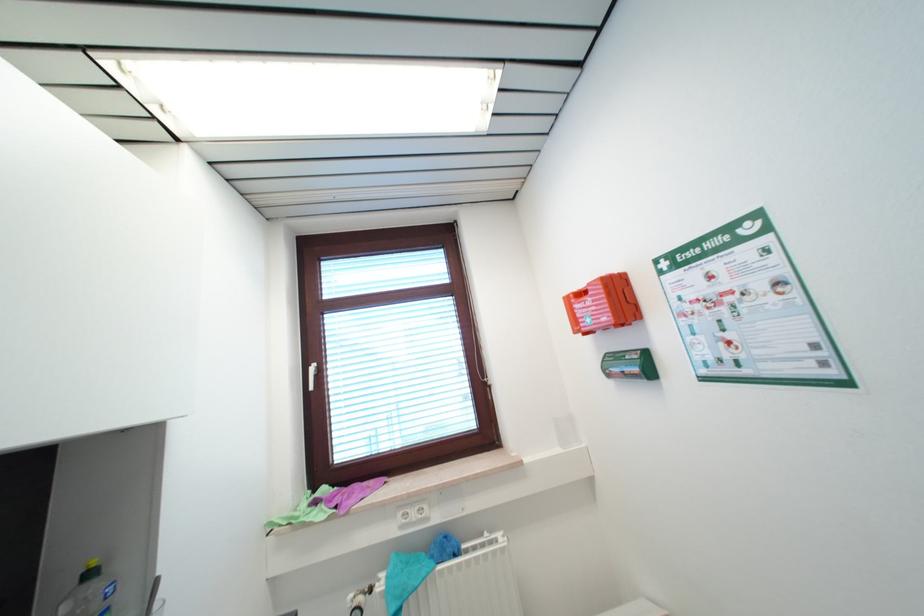
What do you see at coordinates (310, 376) in the screenshot? I see `the white window handle` at bounding box center [310, 376].